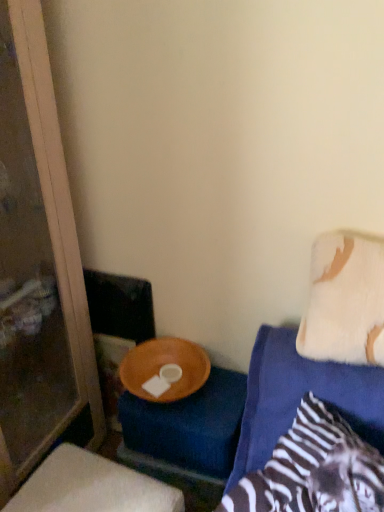
Question: From a real-world perspective, is wooden bowl at lower center under white fluffy pillow at upper right?

Choices:
 (A) no
 (B) yes

Answer: (B)

Question: Are wooden bowl at lower center and white fluffy pillow at upper right far apart?

Choices:
 (A) no
 (B) yes

Answer: (A)

Question: Considering the relative sizes of wooden bowl at lower center and white fluffy pillow at upper right in the image provided, is wooden bowl at lower center wider than white fluffy pillow at upper right?

Choices:
 (A) no
 (B) yes

Answer: (B)

Question: Considering the relative positions of wooden bowl at lower center and white fluffy pillow at upper right in the image provided, is wooden bowl at lower center to the right of white fluffy pillow at upper right from the viewer's perspective?

Choices:
 (A) yes
 (B) no

Answer: (B)

Question: Is wooden bowl at lower center at the left side of white fluffy pillow at upper right?

Choices:
 (A) yes
 (B) no

Answer: (A)

Question: From a real-world perspective, is wooden bowl at lower center positioned over white fluffy pillow at upper right based on gravity?

Choices:
 (A) no
 (B) yes

Answer: (A)

Question: Considering the relative sizes of transparent glass screen door at left and wooden bowl at lower center in the image provided, is transparent glass screen door at left taller than wooden bowl at lower center?

Choices:
 (A) no
 (B) yes

Answer: (B)

Question: Is transparent glass screen door at left shorter than wooden bowl at lower center?

Choices:
 (A) yes
 (B) no

Answer: (B)

Question: Could you tell me if transparent glass screen door at left is facing wooden bowl at lower center?

Choices:
 (A) no
 (B) yes

Answer: (B)

Question: From the image's perspective, is transparent glass screen door at left below wooden bowl at lower center?

Choices:
 (A) yes
 (B) no

Answer: (B)

Question: Is there a large distance between transparent glass screen door at left and wooden bowl at lower center?

Choices:
 (A) no
 (B) yes

Answer: (A)

Question: Would you say wooden bowl at lower center is part of transparent glass screen door at left's contents?

Choices:
 (A) no
 (B) yes

Answer: (A)

Question: Does white fluffy pillow at upper right have a smaller size compared to transparent glass screen door at left?

Choices:
 (A) yes
 (B) no

Answer: (A)